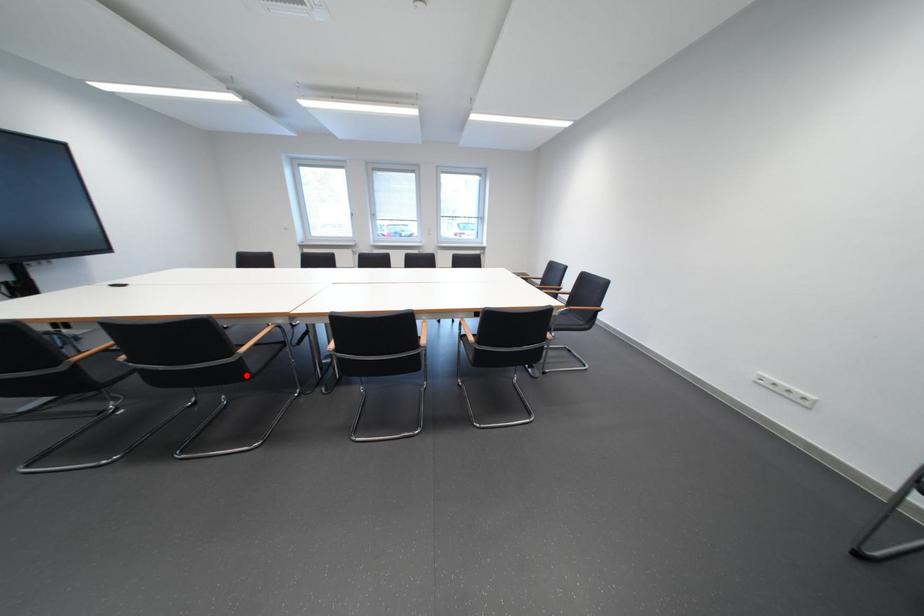
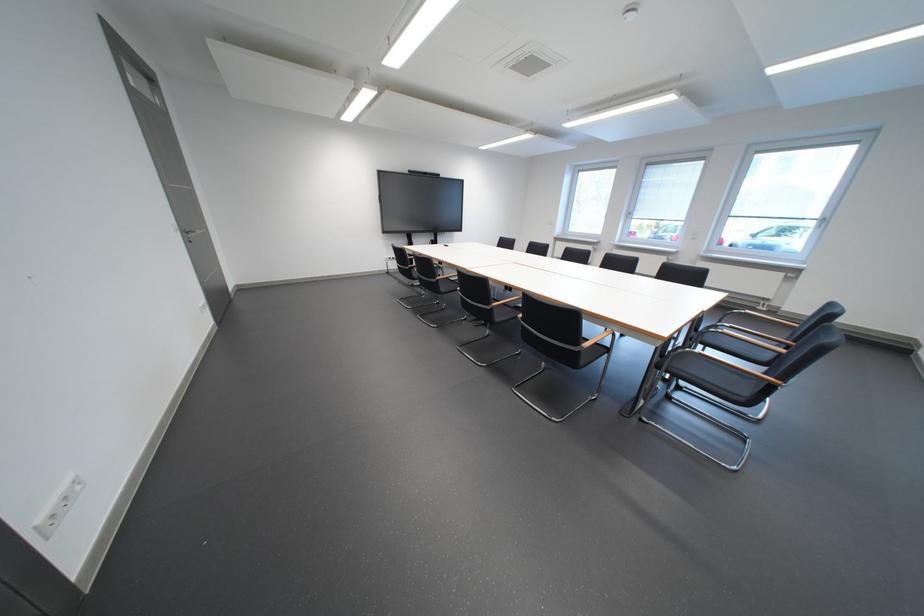
In the second image, find the point that corresponds to the highlighted location in the first image.

(447, 290)